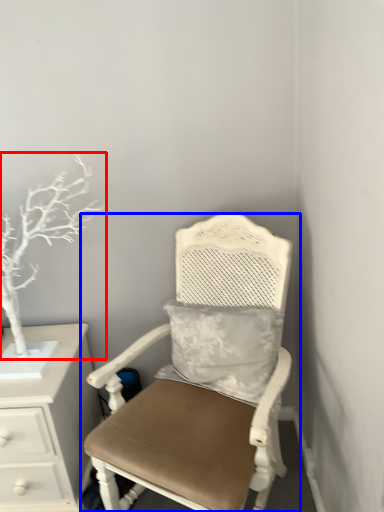
Question: Which object is closer to the camera taking this photo, tree (highlighted by a red box) or chair (highlighted by a blue box)?

Choices:
 (A) tree
 (B) chair

Answer: (B)